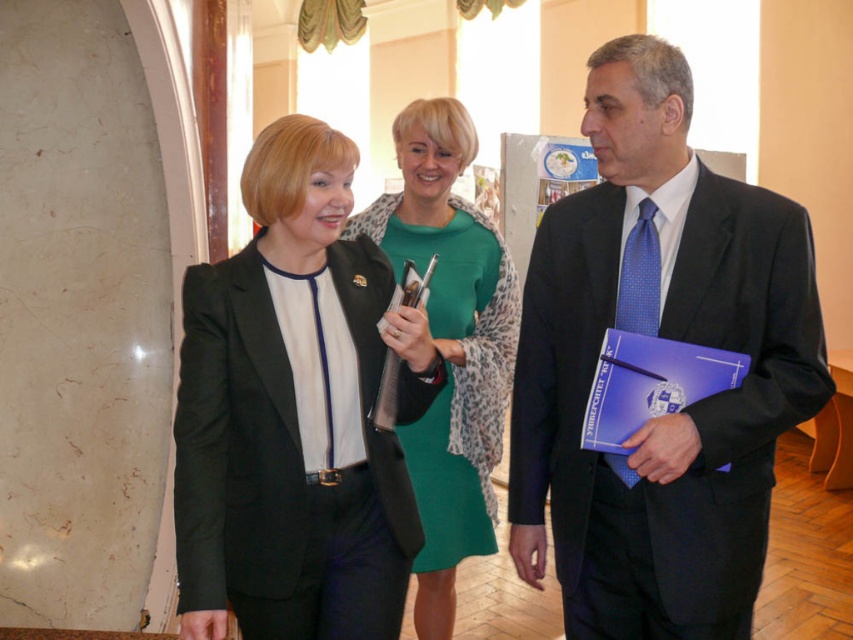
You are a photographer setting up for a professional photoshoot in the described scene. You need to ensure that both the matte black blazer at center and the green matte dress at center are fully visible in the frame. Based on their heights, which clothing item requires you to adjust your camera angle upwards to capture it in full?

The green matte dress at center is taller than the matte black blazer at center. To capture the entire green matte dress at center in the frame, you would need to angle the camera upwards since it is taller.

Based on the photo, you are standing at the camera position and want to hand a document to the person wearing the matte black suit at center. Can you reach them without moving from your current position?

The matte black suit at center and camera are 1.99 meters apart from each other. The average human arm length is about 0.7 meters, so you cannot reach them without moving.

From the picture: You are standing in the room and want to move towards the point that is closer to you. Which point should you head towards, point [566,412] or point [494,308]?

You should head towards point [566,412] because it is closer to the viewer than point [494,308].